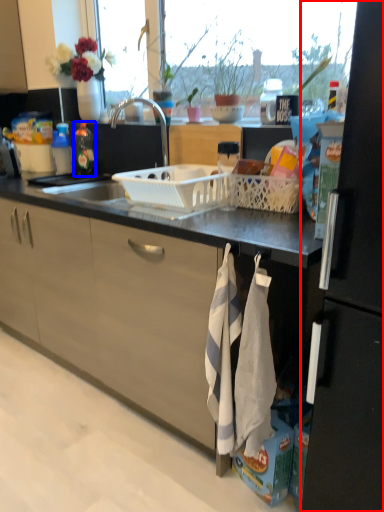
Question: Which object appears closest to the camera in this image, refrigerator (highlighted by a red box) or kitchen appliance (highlighted by a blue box)?

Choices:
 (A) refrigerator
 (B) kitchen appliance

Answer: (A)